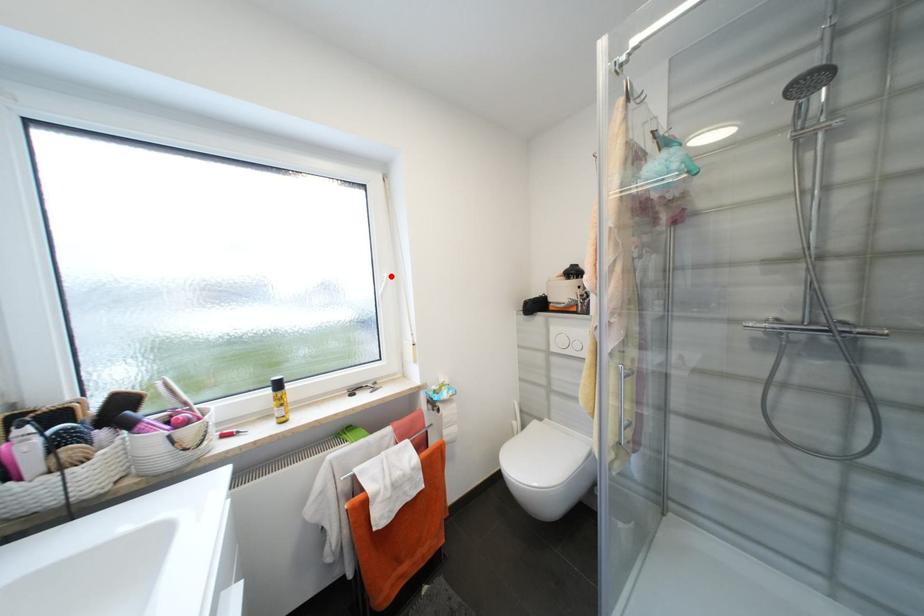
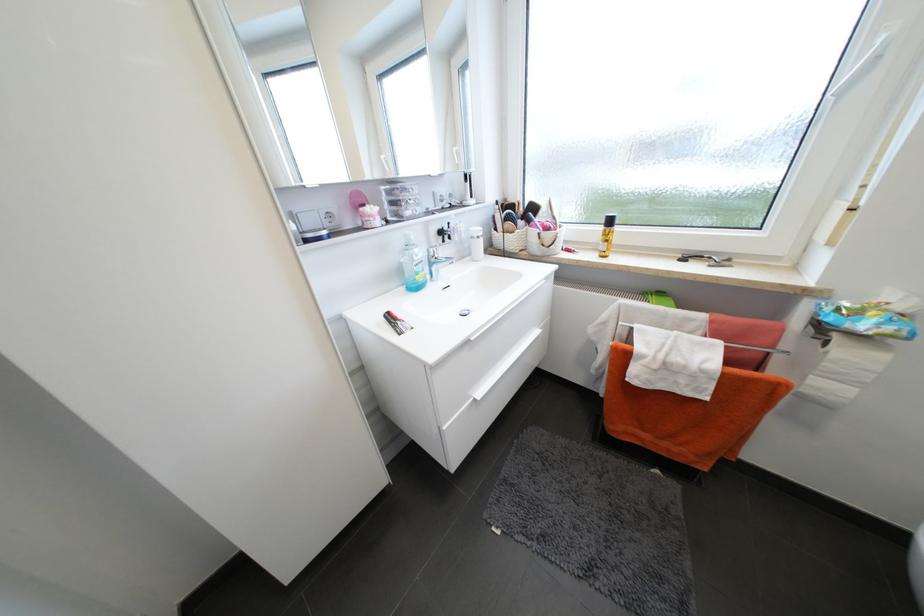
Find the pixel in the second image that matches the highlighted location in the first image.

(888, 41)